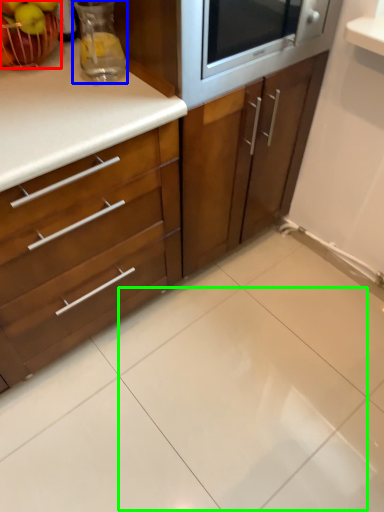
Question: Which is nearer to the apple (highlighted by a red box)? appliance (highlighted by a blue box) or ceramic tile (highlighted by a green box).

Choices:
 (A) appliance
 (B) ceramic tile

Answer: (A)